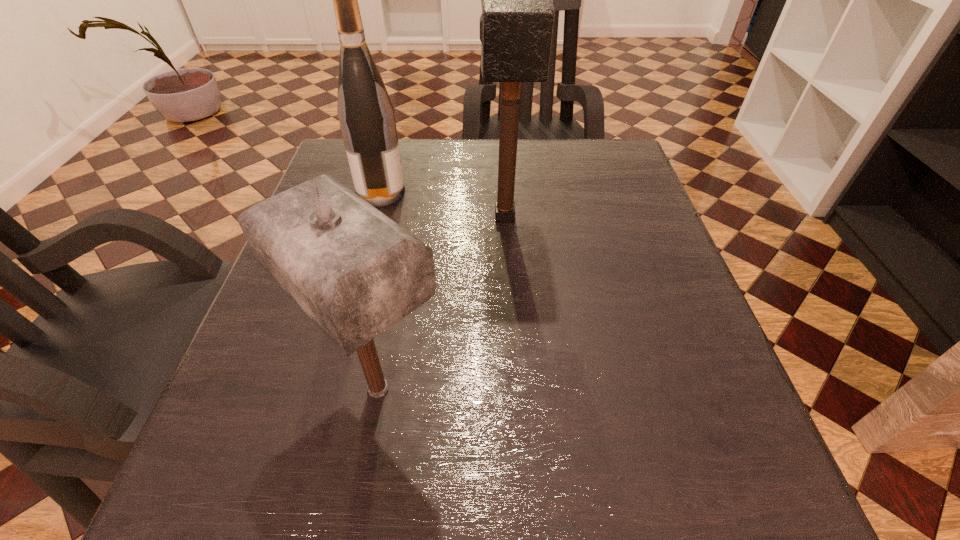
Locate an element on the screen. The height and width of the screenshot is (540, 960). empty space that is in between the farther mallet and the wine bottle is located at coordinates (443, 204).

At what (x,y) coordinates should I click in order to perform the action: click on free space that is in between the right mallet and the left mallet. Please return your answer as a coordinate pair (x, y). Looking at the image, I should click on (442, 302).

In order to click on vacant area that lies between the rightmost object and the nearer mallet in this screenshot , I will do `click(442, 302)`.

Where is `free area in between the nearest object and the rightmost object`? This screenshot has width=960, height=540. free area in between the nearest object and the rightmost object is located at coordinates (442, 302).

At what (x,y) coordinates should I click in order to perform the action: click on free space between the nearer mallet and the farther mallet. Please return your answer as a coordinate pair (x, y). This screenshot has width=960, height=540. Looking at the image, I should click on (442, 302).

This screenshot has height=540, width=960. Identify the location of unoccupied position between the nearer mallet and the rightmost object. (442, 302).

Where is `free space between the wine bottle and the rightmost object`? free space between the wine bottle and the rightmost object is located at coordinates (443, 204).

Locate which object is the closest to the wine bottle. Please provide its 2D coordinates. Your answer should be formatted as a tuple, i.e. [(x, y)], where the tuple contains the x and y coordinates of a point satisfying the conditions above.

[(516, 25)]

Identify which object is the closest to the wine bottle. Please provide its 2D coordinates. Your answer should be formatted as a tuple, i.e. [(x, y)], where the tuple contains the x and y coordinates of a point satisfying the conditions above.

[(516, 25)]

Locate an element on the screen. This screenshot has width=960, height=540. free space that satisfies the following two spatial constraints: 1. on the front side of the wine bottle; 2. on the left side of the farther mallet is located at coordinates (374, 217).